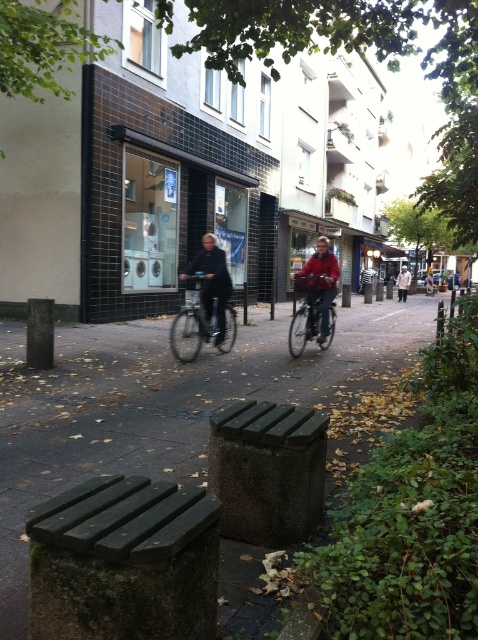
Is dark green wooden bench at center behind light beige coat at center?

No, dark green wooden bench at center is in front of light beige coat at center.

Is dark green wooden bench at center in front of light beige coat at center?

Yes.

Image resolution: width=478 pixels, height=640 pixels. Identify the location of dark green wooden bench at center. (123, 561).

Where is `dark green wooden bench at center`? The image size is (478, 640). dark green wooden bench at center is located at coordinates (123, 561).

Is dark green wooden bench at lower center wider than dark blue jacket at center?

Yes.

Is dark green wooden bench at lower center above dark blue jacket at center?

No.

Image resolution: width=478 pixels, height=640 pixels. Describe the element at coordinates (268, 470) in the screenshot. I see `dark green wooden bench at lower center` at that location.

I want to click on dark green wooden bench at lower center, so click(268, 470).

Is dark green wooden bench at center to the left of dark blue jacket at center from the viewer's perspective?

No, dark green wooden bench at center is not to the left of dark blue jacket at center.

How much distance is there between dark green wooden bench at center and dark blue jacket at center?

dark green wooden bench at center is 6.73 meters away from dark blue jacket at center.

Identify the location of dark green wooden bench at center. The height and width of the screenshot is (640, 478). (123, 561).